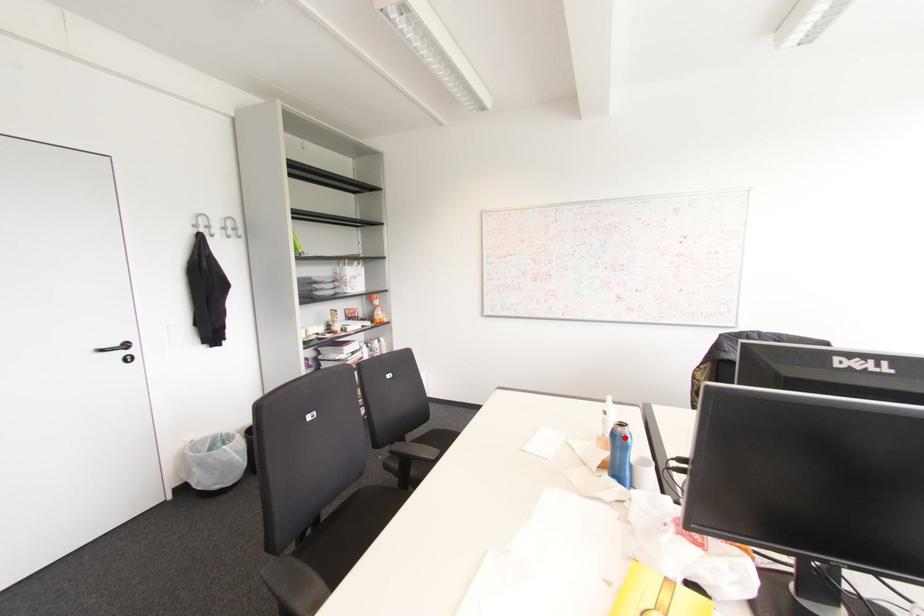
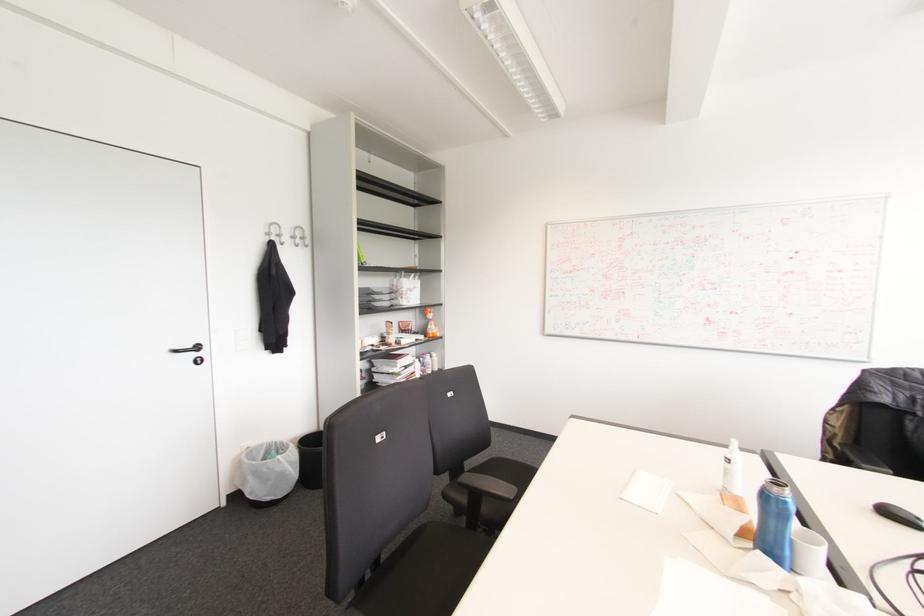
The point at the highlighted location is marked in the first image. Where is the corresponding point in the second image?

(784, 503)